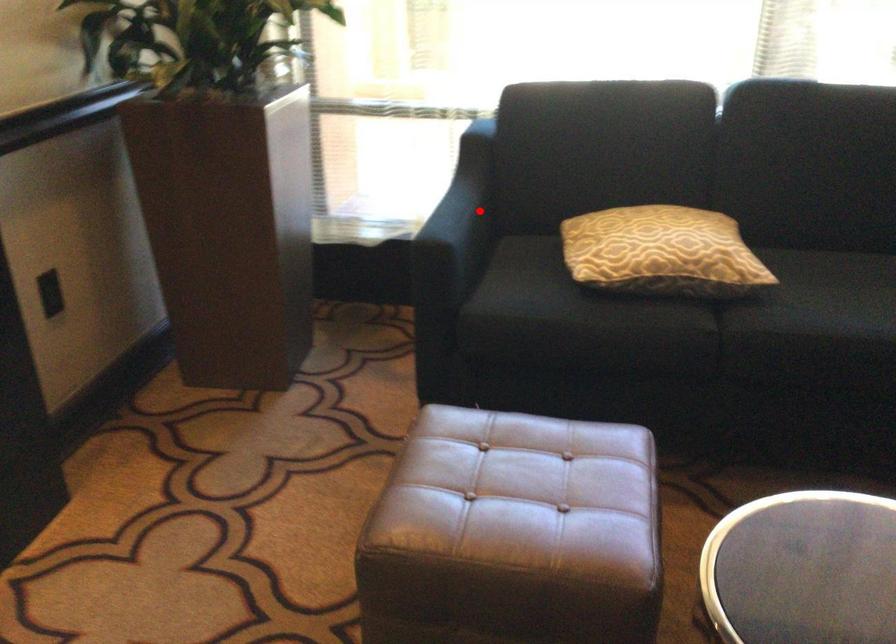
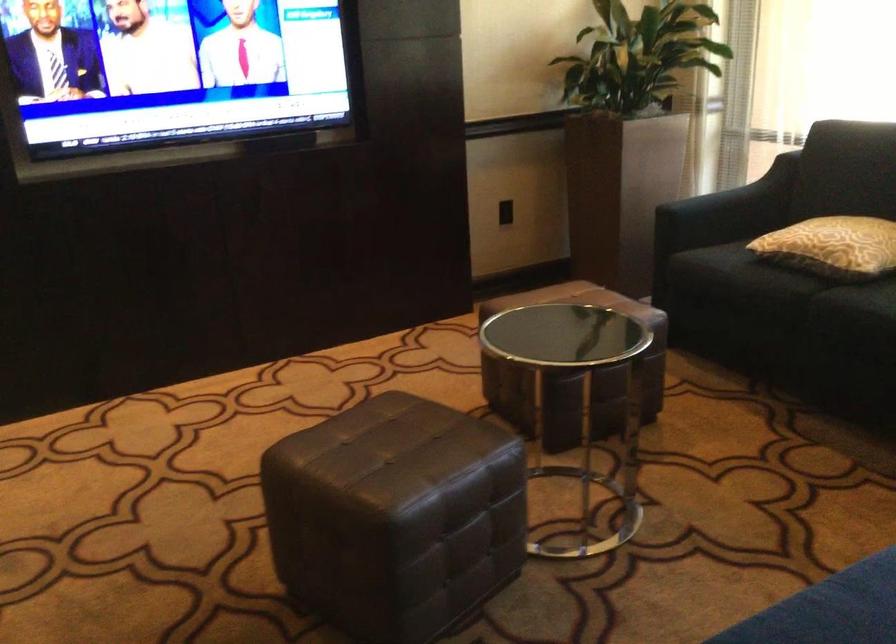
Question: A red point is marked in image1. In image2, is the corresponding 3D point closer to the camera or farther? Reply with the corresponding letter.

Choices:
 (A) The corresponding 3D point is closer.
 (B) The corresponding 3D point is farther.

Answer: (B)